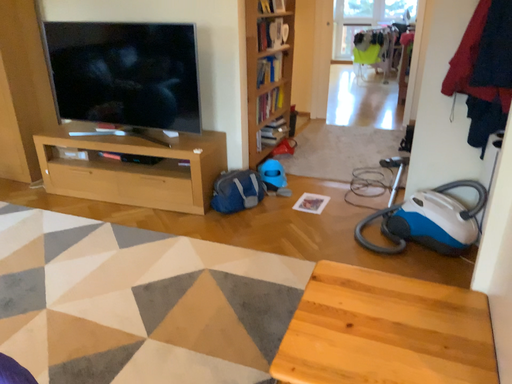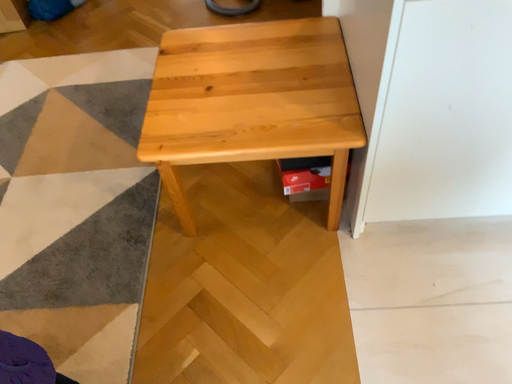
Question: How did the camera likely rotate when shooting the video?

Choices:
 (A) rotated left
 (B) rotated right

Answer: (B)